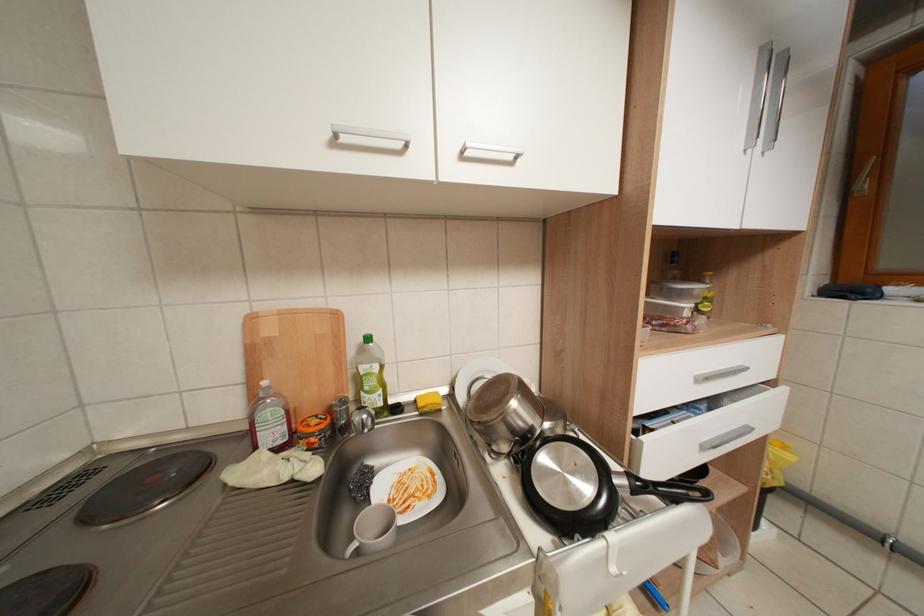
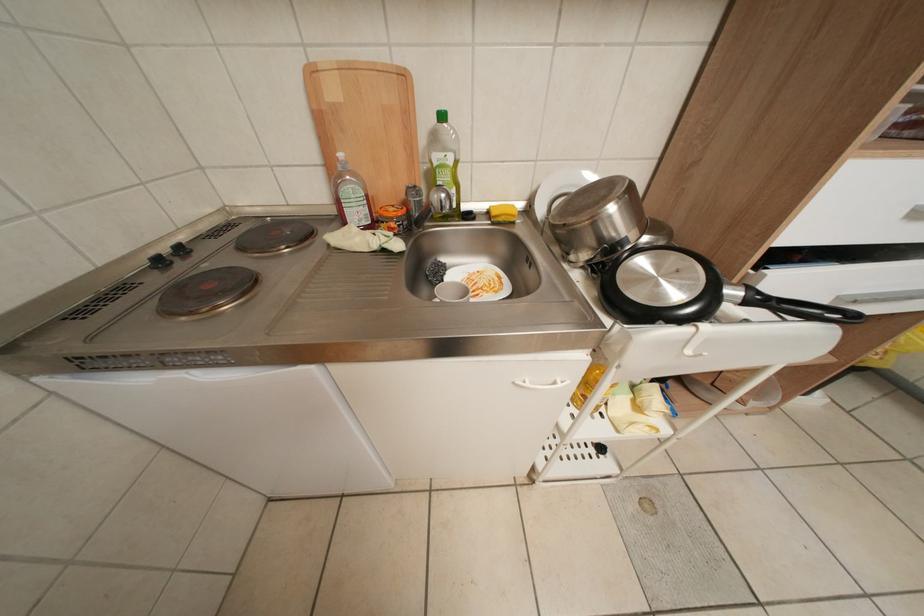
Question: Based on the continuous images, in which direction is the camera rotating? Reply with the corresponding letter.

Choices:
 (A) Left
 (B) Right
 (C) Up
 (D) Down

Answer: (D)